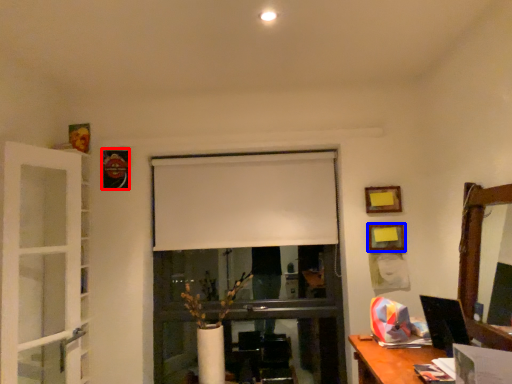
Question: Which object appears closest to the camera in this image, picture frame (highlighted by a red box) or picture frame (highlighted by a blue box)?

Choices:
 (A) picture frame
 (B) picture frame

Answer: (B)